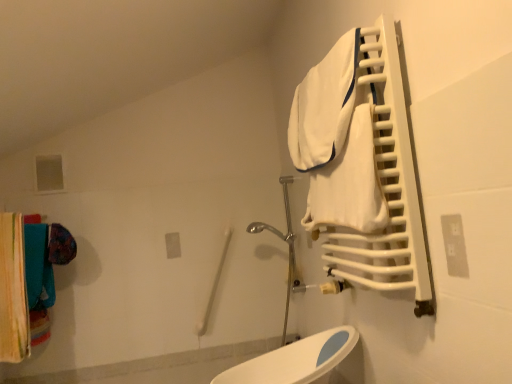
What is the approximate width of multicolored fabric beach towel at left?

The width of multicolored fabric beach towel at left is 5.90 inches.

Image resolution: width=512 pixels, height=384 pixels. What do you see at coordinates (13, 291) in the screenshot?
I see `multicolored fabric beach towel at left` at bounding box center [13, 291].

Find the location of `multicolored fabric beach towel at left`. multicolored fabric beach towel at left is located at coordinates (13, 291).

Where is `multicolored fabric beach towel at left`? Image resolution: width=512 pixels, height=384 pixels. multicolored fabric beach towel at left is located at coordinates (13, 291).